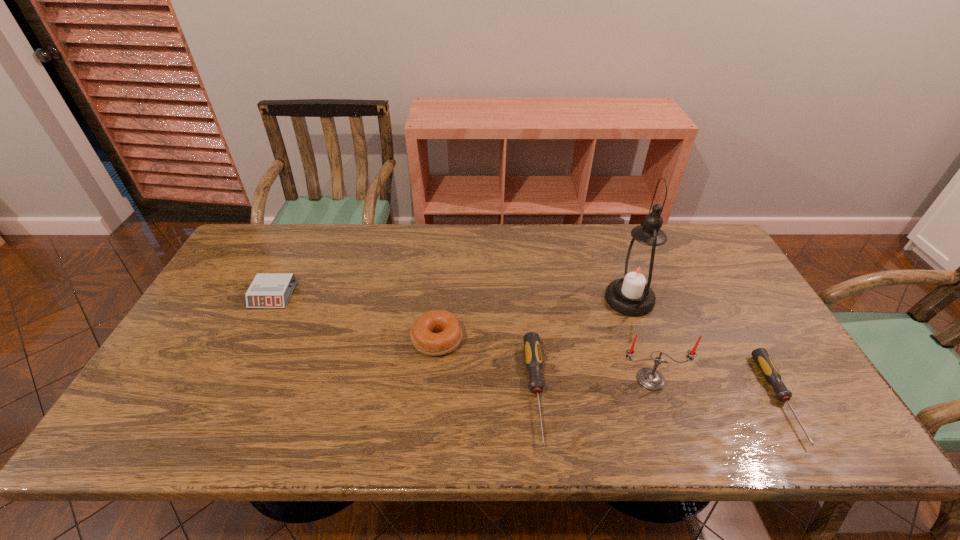
The screwdrivers are evenly distributed in the image. To maintain this, where would you place another screwdriver on the left? Please point to a free space. Please provide its 2D coordinates. Your answer should be formatted as a tuple, i.e. [(x, y)], where the tuple contains the x and y coordinates of a point satisfying the conditions above.

[(300, 383)]